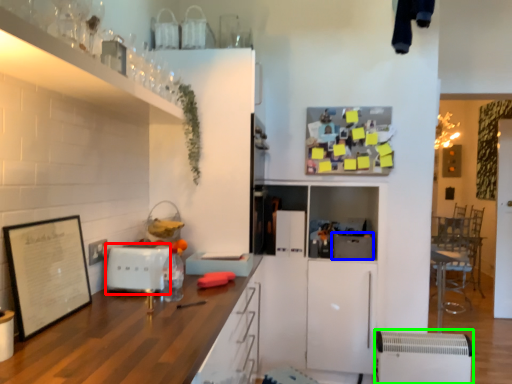
Question: Which object is the closest to the appliance (highlighted by a red box)? Choose among these: appliance (highlighted by a blue box) or appliance (highlighted by a green box).

Choices:
 (A) appliance
 (B) appliance

Answer: (A)